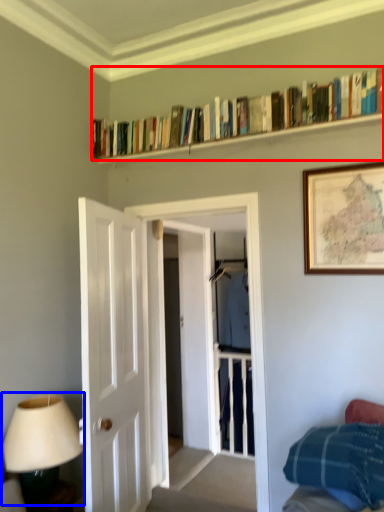
Question: Which object is closer to the camera taking this photo, book (highlighted by a red box) or table lamp (highlighted by a blue box)?

Choices:
 (A) book
 (B) table lamp

Answer: (B)